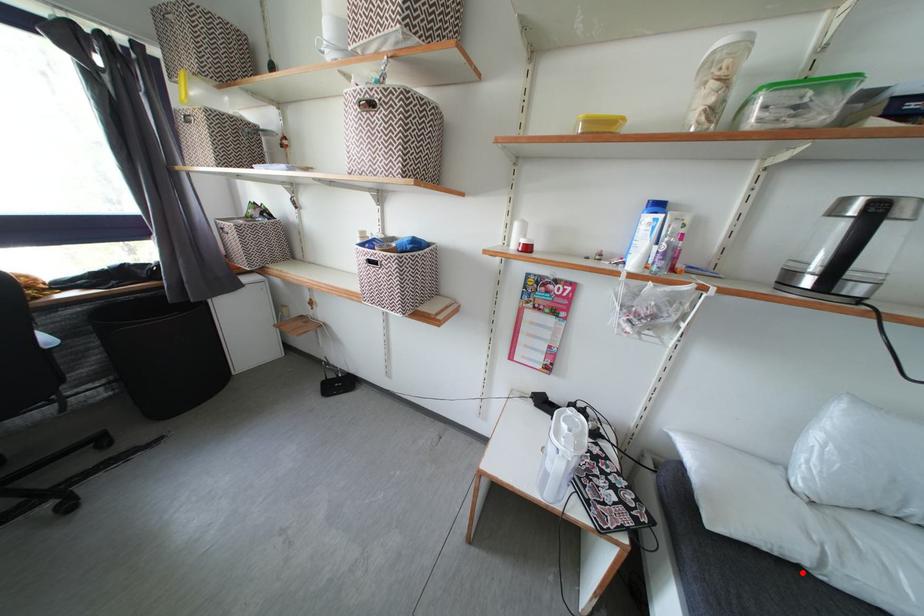
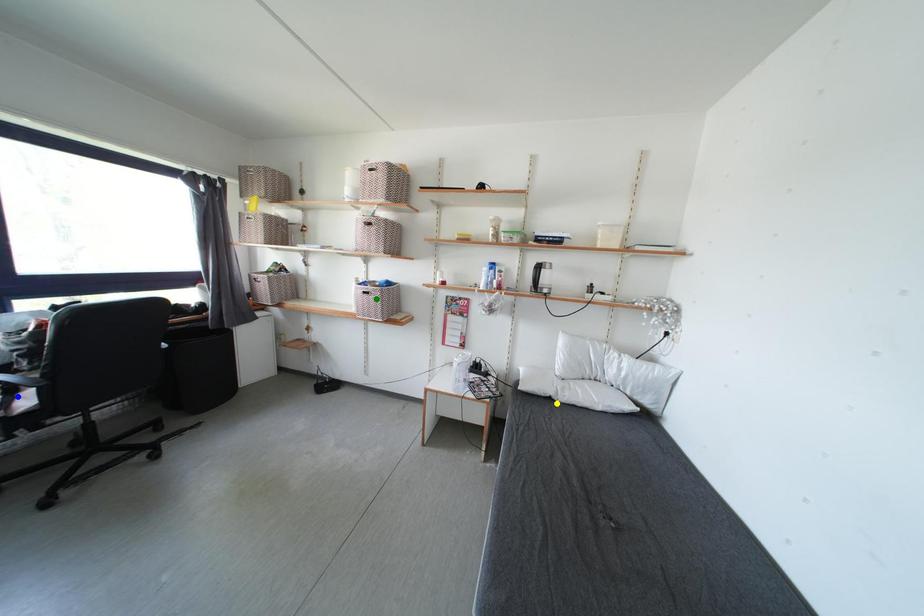
Question: I am providing you with two images of the same scene from different viewpoints. A red point is marked on the first image. You are given multiple points on the second image. Which point in image 2 represents the same 3d spot as the red point in image 1?

Choices:
 (A) blue point
 (B) green point
 (C) yellow point

Answer: (C)